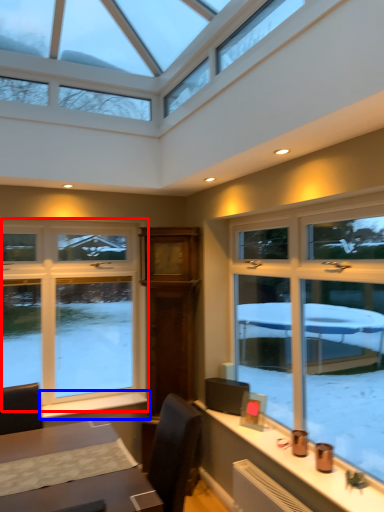
Question: Among these objects, which one is farthest to the camera, window (highlighted by a red box) or window sill (highlighted by a blue box)?

Choices:
 (A) window
 (B) window sill

Answer: (A)